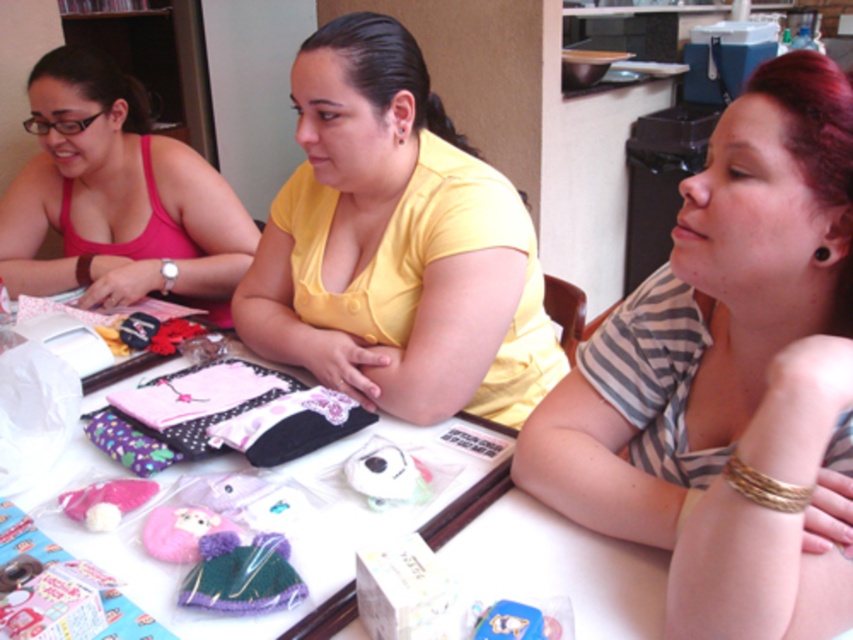
You are a jewelry designer observing the craft table. You need to place a new necklace between the gold metallic bracelet at lower right and the black plastic earring at upper right. Based on their positions, where should you place the necklace to maintain the spatial arrangement?

The gold metallic bracelet at lower right is below the black plastic earring at upper right, so to maintain the spatial arrangement, place the necklace between them vertically, ensuring it is above the gold metallic bracelet at lower right and below the black plastic earring at upper right.

You are organizing a craft fair booth and need to arrange items on a shelf. You have the striped fabric shirt at upper right and the gold metallic bracelet at lower right. Based on their sizes, which item should you place higher up on the shelf to save space?

The striped fabric shirt at upper right is much taller than the gold metallic bracelet at lower right, so placing the striped fabric shirt at upper right higher up on the shelf would save space by utilizing vertical space more effectively.

You are a jeweler examining the items on the table. You need to place a protective cover over the taller item between the gold metallic bracelet at lower right and the black plastic earring at upper right. Which item should you cover?

The gold metallic bracelet at lower right is taller than the black plastic earring at upper right, so you should cover the gold metallic bracelet at lower right.